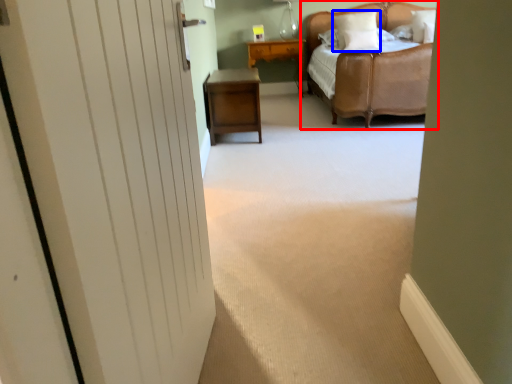
Question: Which object is closer to the camera taking this photo, bed (highlighted by a red box) or pillow (highlighted by a blue box)?

Choices:
 (A) bed
 (B) pillow

Answer: (A)